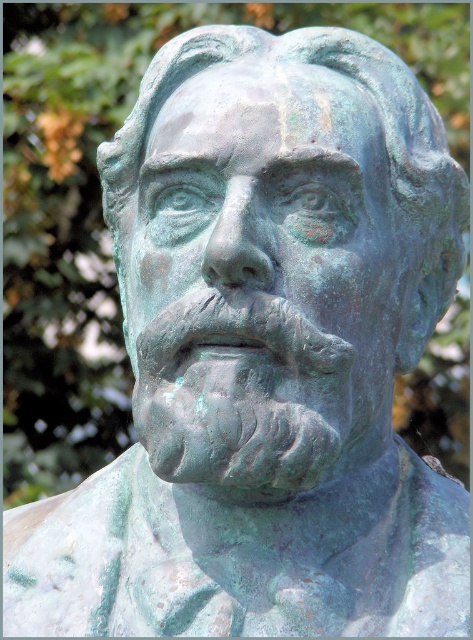
Question: Can you confirm if green patina bust at center is bigger than green patina nose at center?

Choices:
 (A) no
 (B) yes

Answer: (B)

Question: Which of the following is the farthest from the observer?

Choices:
 (A) green patina bust at center
 (B) green patina nose at center

Answer: (A)

Question: Which point is farther from the camera taking this photo?

Choices:
 (A) (339, 128)
 (B) (257, 269)

Answer: (A)

Question: Is green patina bust at center bigger than green patina nose at center?

Choices:
 (A) no
 (B) yes

Answer: (B)

Question: Is green patina bust at center bigger than green patina nose at center?

Choices:
 (A) no
 (B) yes

Answer: (B)